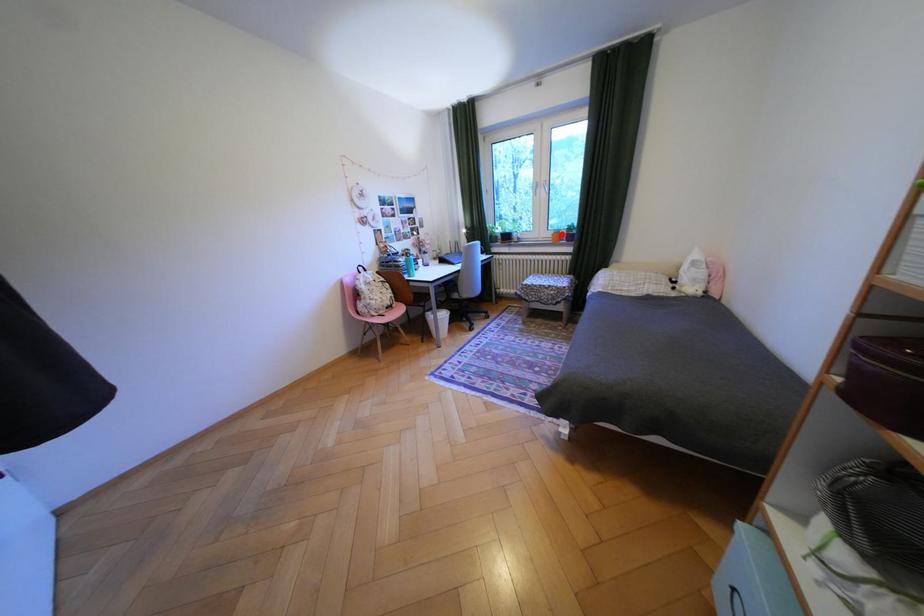
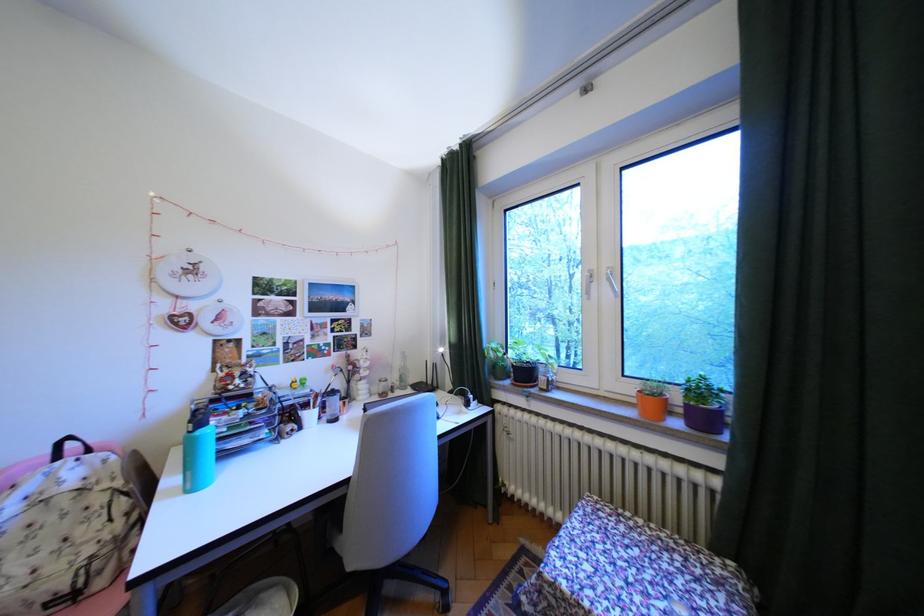
Question: I am providing you with two images of the same scene from different viewpoints. A red point is marked on the first image. Can you still see the location of the red point in image 2?

Choices:
 (A) Yes
 (B) No

Answer: (A)